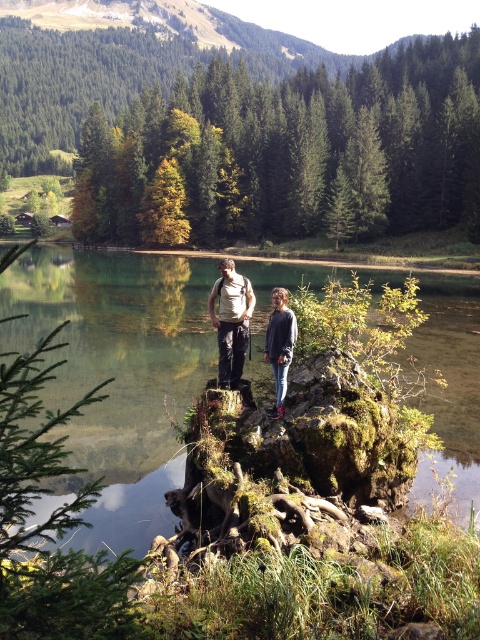
Which of these two, khaki fabric pants at center or gray sweater at center, stands taller?

khaki fabric pants at center is taller.

The height and width of the screenshot is (640, 480). What do you see at coordinates (230, 321) in the screenshot? I see `khaki fabric pants at center` at bounding box center [230, 321].

Is point (242, 314) less distant than point (288, 365)?

No, (242, 314) is further to viewer.

Where is `khaki fabric pants at center`? khaki fabric pants at center is located at coordinates (230, 321).

Can you confirm if green mossy rock at center is positioned to the left of gray sweater at center?

Yes, green mossy rock at center is to the left of gray sweater at center.

Who is more forward, (23, 349) or (277, 380)?

Point (277, 380)

At what (x,y) coordinates should I click in order to perform the action: click on green mossy rock at center. Please return your answer as a coordinate pair (x, y). The width and height of the screenshot is (480, 640). Looking at the image, I should click on (118, 372).

Find the location of `green mossy rock at center`. green mossy rock at center is located at coordinates (118, 372).

Does green mossy rock at center appear on the left side of khaki fabric pants at center?

Correct, you'll find green mossy rock at center to the left of khaki fabric pants at center.

Which is more to the right, green mossy rock at center or khaki fabric pants at center?

khaki fabric pants at center

Does point (427, 401) come farther from viewer compared to point (235, 332)?

Yes, point (427, 401) is behind point (235, 332).

Where is `green mossy rock at center`? Image resolution: width=480 pixels, height=640 pixels. green mossy rock at center is located at coordinates (118, 372).